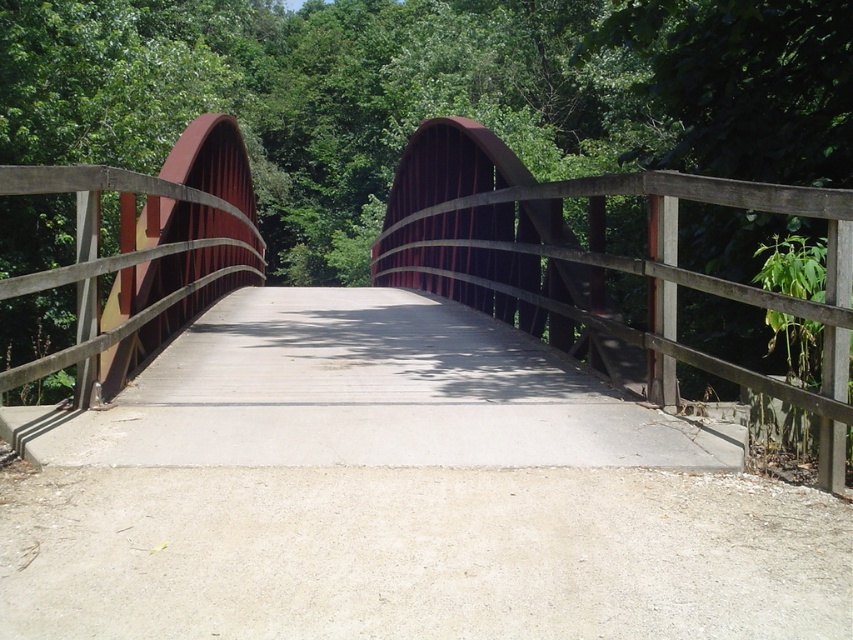
Between point (567, 337) and point (341, 454), which one is positioned behind?

The point (567, 337) is more distant.

Who is shorter, metallic gray bridge at center or concrete at center?

concrete at center is shorter.

Does point (245, 168) come in front of point (401, 344)?

That is False.

Where is `metallic gray bridge at center`? Image resolution: width=853 pixels, height=640 pixels. metallic gray bridge at center is located at coordinates pos(599,262).